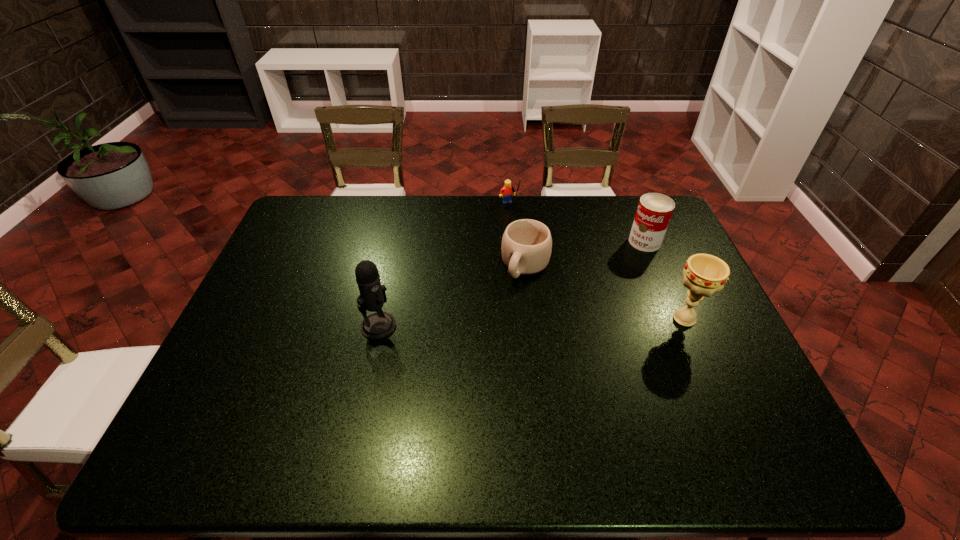
I want to click on free space between the second tallest object and the can, so click(x=664, y=280).

Identify the location of empty space that is in between the tallest object and the second tallest object. (532, 322).

This screenshot has width=960, height=540. I want to click on free space that is in between the tallest object and the farthest object, so click(x=444, y=266).

Locate an element on the screen. vacant area that lies between the Lego and the microphone is located at coordinates (444, 266).

Locate an element on the screen. vacant space that's between the tallest object and the can is located at coordinates (512, 284).

Identify the location of vacant area that lies between the farthest object and the can. The image size is (960, 540). (577, 224).

This screenshot has height=540, width=960. I want to click on blank region between the second tallest object and the third shortest object, so click(664, 280).

The image size is (960, 540). Find the location of `free space between the tallest object and the fourth shortest object`. free space between the tallest object and the fourth shortest object is located at coordinates (532, 322).

Image resolution: width=960 pixels, height=540 pixels. Identify the location of free space that is in between the mug and the tallest object. (452, 296).

At what (x,y) coordinates should I click in order to perform the action: click on object that stands as the fourth closest to the farthest object. Please return your answer as a coordinate pair (x, y). Looking at the image, I should click on (704, 274).